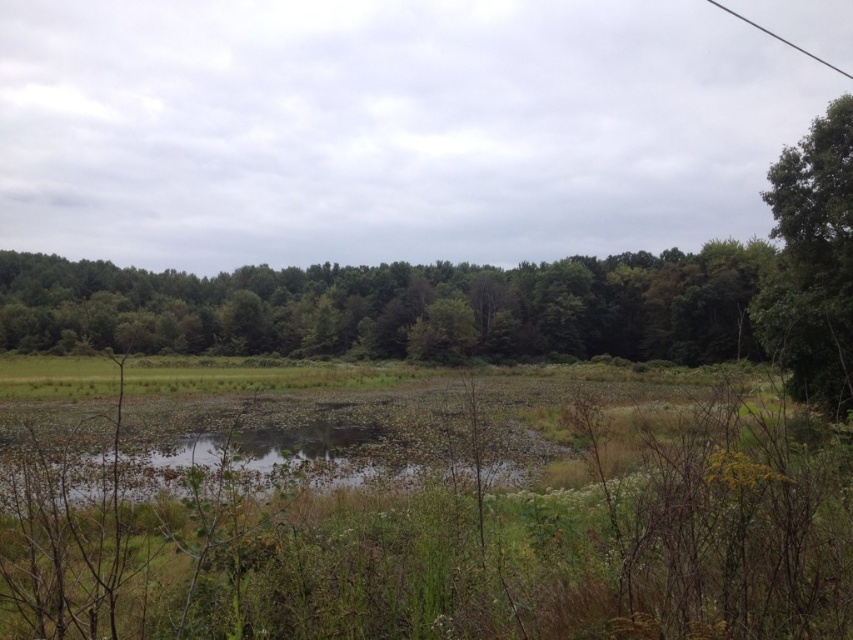
Question: In this image, where is green leafy tree at center located relative to black wire at upper right?

Choices:
 (A) below
 (B) above

Answer: (A)

Question: Observing the image, what is the correct spatial positioning of green leafy tree at right in reference to black wire at upper right?

Choices:
 (A) right
 (B) left

Answer: (B)

Question: Can you confirm if green leafy tree at center is positioned to the left of green grassy lake at center?

Choices:
 (A) yes
 (B) no

Answer: (A)

Question: Estimate the real-world distances between objects in this image. Which object is closer to the green grassy lake at center?

Choices:
 (A) green leafy tree at center
 (B) black wire at upper right

Answer: (A)

Question: Which is farther from the green leafy tree at right?

Choices:
 (A) black wire at upper right
 (B) green leafy tree at center

Answer: (A)

Question: Based on their relative distances, which object is nearer to the green leafy tree at right?

Choices:
 (A) black wire at upper right
 (B) green grassy lake at center

Answer: (B)